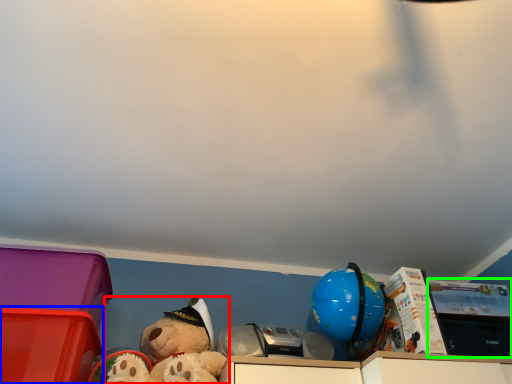
Question: Which is nearer to the teddy bear (highlighted by a red box)? storage box (highlighted by a blue box) or storage box (highlighted by a green box).

Choices:
 (A) storage box
 (B) storage box

Answer: (A)